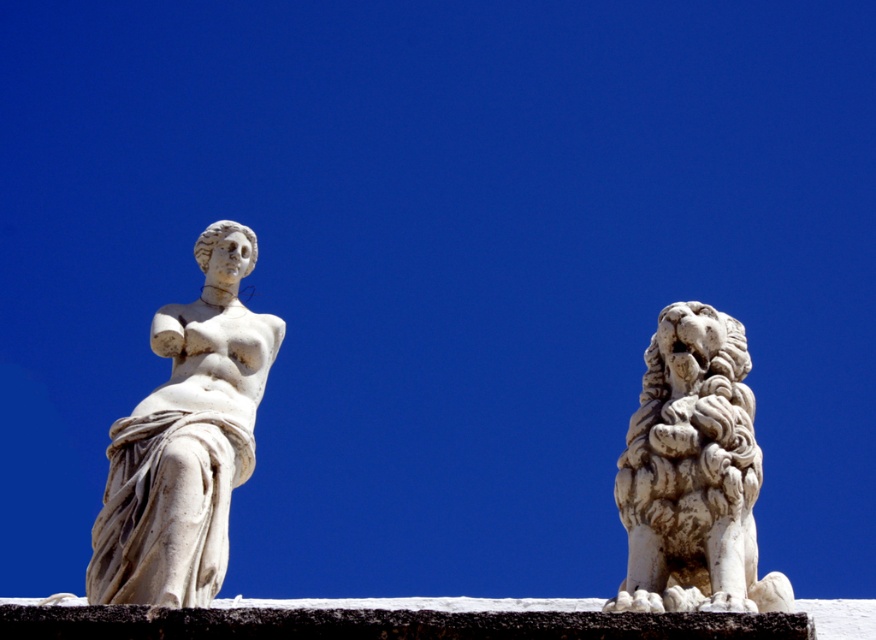
Between point (131, 435) and point (740, 355), which one is positioned in front?

Point (131, 435)

Does point (147, 492) come farther from viewer compared to point (733, 531)?

That is False.

Image resolution: width=876 pixels, height=640 pixels. Find the location of `white marble statue at left`. white marble statue at left is located at coordinates (185, 440).

Locate an element on the screen. The height and width of the screenshot is (640, 876). white marble statue at left is located at coordinates (185, 440).